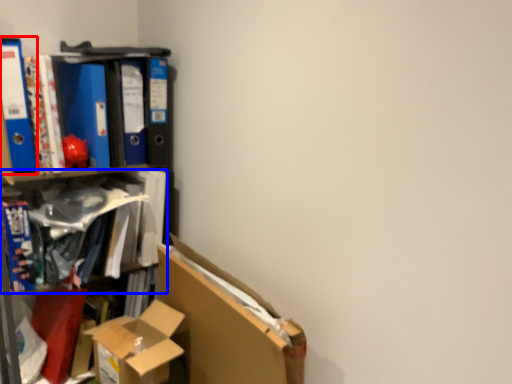
Question: Among these objects, which one is farthest to the camera, paperback book (highlighted by a red box) or book (highlighted by a blue box)?

Choices:
 (A) paperback book
 (B) book

Answer: (B)